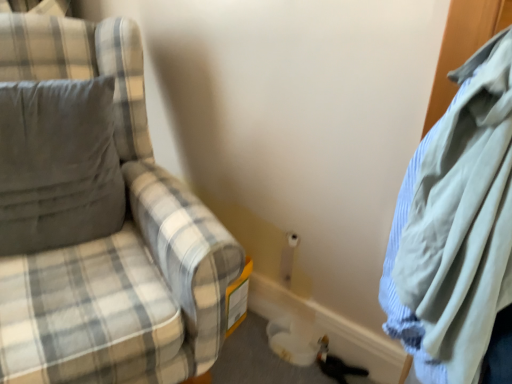
What do you see at coordinates (97, 219) in the screenshot?
I see `plaid fabric chair at left` at bounding box center [97, 219].

This screenshot has width=512, height=384. Describe the element at coordinates (456, 227) in the screenshot. I see `light blue cotton shirt at right` at that location.

I want to click on plaid fabric chair at left, so click(x=97, y=219).

Can you confirm if light blue cotton shirt at right is taller than plaid fabric chair at left?

No, light blue cotton shirt at right is not taller than plaid fabric chair at left.

Can you confirm if light blue cotton shirt at right is wider than plaid fabric chair at left?

In fact, light blue cotton shirt at right might be narrower than plaid fabric chair at left.

How different are the orientations of light blue cotton shirt at right and plaid fabric chair at left in degrees?

The angular difference between light blue cotton shirt at right and plaid fabric chair at left is 68 degrees.

Is light blue cotton shirt at right located within gray fabric pillow at left?

No, light blue cotton shirt at right is not a part of gray fabric pillow at left.

Is gray fabric pillow at left touching light blue cotton shirt at right?

No.

The width and height of the screenshot is (512, 384). In order to click on pillow that is behind the light blue cotton shirt at right in this screenshot , I will do `click(58, 165)`.

Does point (65, 91) come closer to viewer compared to point (453, 184)?

No, it is behind (453, 184).

Is the depth of plaid fabric chair at left greater than that of gray fabric pillow at left?

No, plaid fabric chair at left is closer to the viewer.

Is plaid fabric chair at left facing away from gray fabric pillow at left?

Yes, plaid fabric chair at left's orientation is away from gray fabric pillow at left.

In terms of height, does plaid fabric chair at left look taller or shorter compared to gray fabric pillow at left?

plaid fabric chair at left is taller than gray fabric pillow at left.

The height and width of the screenshot is (384, 512). I want to click on cloak that appears on the right of gray fabric pillow at left, so [456, 227].

Can you confirm if light blue cotton shirt at right is taller than gray fabric pillow at left?

Yes.

From a real-world perspective, who is located lower, light blue cotton shirt at right or gray fabric pillow at left?

gray fabric pillow at left, from a real-world perspective.

Is light blue cotton shirt at right wider than gray fabric pillow at left?

Correct, the width of light blue cotton shirt at right exceeds that of gray fabric pillow at left.

How many degrees apart are the facing directions of plaid fabric chair at left and light blue cotton shirt at right?

The angular difference between plaid fabric chair at left and light blue cotton shirt at right is 68 degrees.

Does plaid fabric chair at left have a greater width compared to light blue cotton shirt at right?

Indeed, plaid fabric chair at left has a greater width compared to light blue cotton shirt at right.

Based on the photo, from the image's perspective, is plaid fabric chair at left located above or below light blue cotton shirt at right?

From the image's perspective, plaid fabric chair at left appears below light blue cotton shirt at right.

Are plaid fabric chair at left and light blue cotton shirt at right beside each other?

No, plaid fabric chair at left is not beside light blue cotton shirt at right.

From the image's perspective, which one is positioned higher, gray fabric pillow at left or plaid fabric chair at left?

gray fabric pillow at left appears higher in the image.

Is plaid fabric chair at left at the back of gray fabric pillow at left?

Correct, gray fabric pillow at left is looking away from plaid fabric chair at left.

Are gray fabric pillow at left and plaid fabric chair at left located far from each other?

No, there isn't a large distance between gray fabric pillow at left and plaid fabric chair at left.

Between gray fabric pillow at left and plaid fabric chair at left, which one has more height?

With more height is plaid fabric chair at left.

Identify the location of cloak in front of the plaid fabric chair at left. The height and width of the screenshot is (384, 512). (456, 227).

You are a GUI agent. You are given a task and a screenshot of the screen. Output one action in this format:
    pyautogui.click(x=<x>, y=<y>)
    Task: Click on the cloak above the gray fabric pillow at left (from a real-world perspective)
    
    Given the screenshot: What is the action you would take?
    pyautogui.click(x=456, y=227)

Looking at the image, which one is located closer to plaid fabric chair at left, light blue cotton shirt at right or gray fabric pillow at left?

Among the two, gray fabric pillow at left is located nearer to plaid fabric chair at left.

Which object lies nearer to the anchor point gray fabric pillow at left, plaid fabric chair at left or light blue cotton shirt at right?

plaid fabric chair at left is closer to gray fabric pillow at left.

Estimate the real-world distances between objects in this image. Which object is closer to light blue cotton shirt at right, plaid fabric chair at left or gray fabric pillow at left?

The object closer to light blue cotton shirt at right is plaid fabric chair at left.

Which object lies nearer to the anchor point light blue cotton shirt at right, gray fabric pillow at left or plaid fabric chair at left?

plaid fabric chair at left.

Which object lies nearer to the anchor point gray fabric pillow at left, light blue cotton shirt at right or plaid fabric chair at left?

Among the two, plaid fabric chair at left is located nearer to gray fabric pillow at left.

Which object lies nearer to the anchor point plaid fabric chair at left, gray fabric pillow at left or light blue cotton shirt at right?

Among the two, gray fabric pillow at left is located nearer to plaid fabric chair at left.

Where is `chair between gray fabric pillow at left and light blue cotton shirt at right from left to right`? chair between gray fabric pillow at left and light blue cotton shirt at right from left to right is located at coordinates (97, 219).